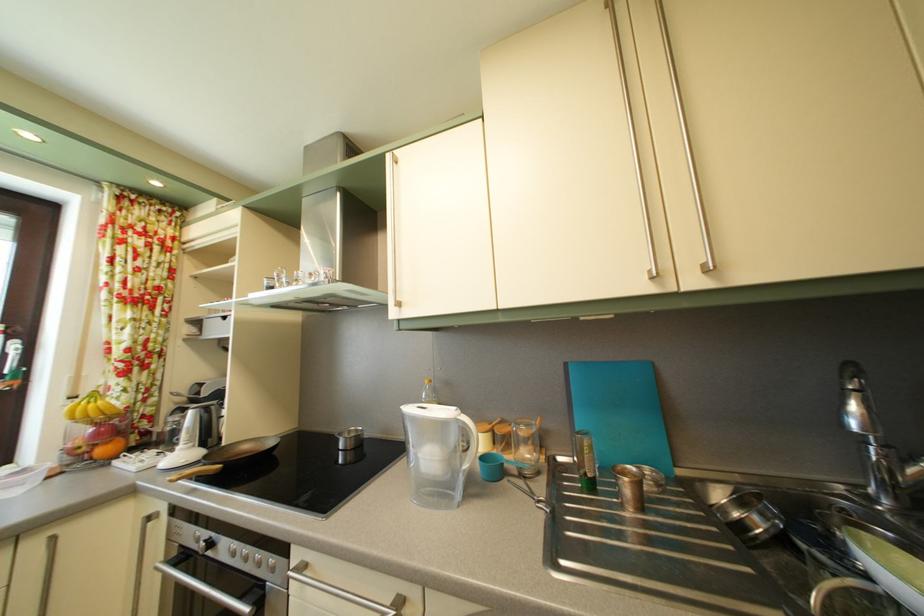
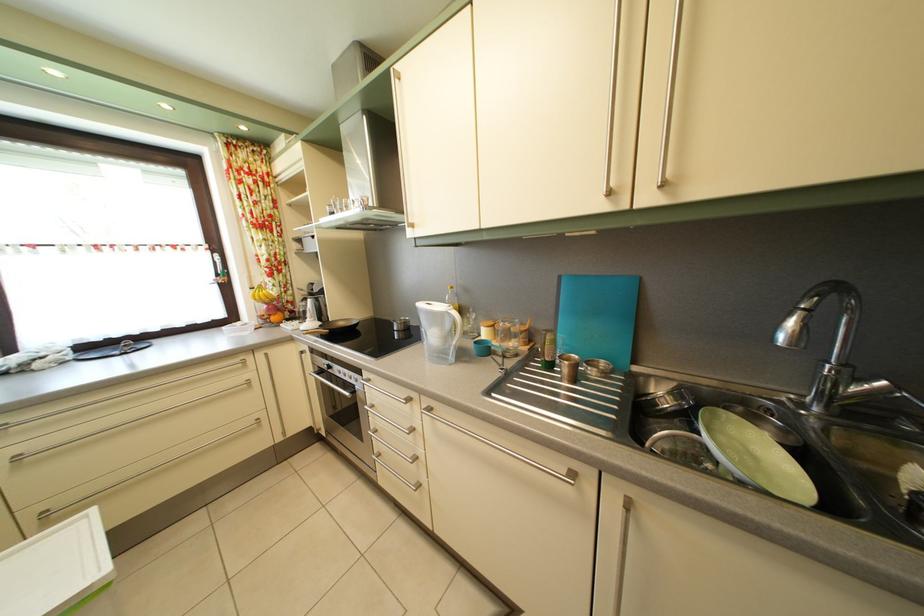
In the second image, find the point that corresponds to (x=42, y=551) in the first image.

(268, 363)